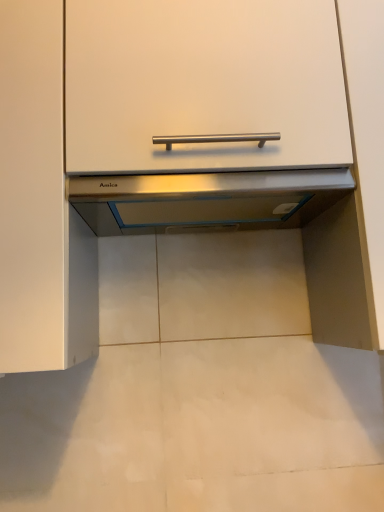
Question: Visually, is satin silver cabinet at center positioned to the left or to the right of satin silver exhaust hood at center?

Choices:
 (A) right
 (B) left

Answer: (B)

Question: Does point (46, 173) appear closer or farther from the camera than point (198, 189)?

Choices:
 (A) farther
 (B) closer

Answer: (B)

Question: In terms of size, does satin silver cabinet at center appear bigger or smaller than satin silver exhaust hood at center?

Choices:
 (A) small
 (B) big

Answer: (B)

Question: In the image, is satin silver exhaust hood at center positioned in front of or behind satin silver cabinet at center?

Choices:
 (A) behind
 (B) front

Answer: (A)

Question: Based on their positions, is satin silver exhaust hood at center located to the left or right of satin silver cabinet at center?

Choices:
 (A) left
 (B) right

Answer: (B)

Question: From a real-world perspective, is satin silver exhaust hood at center physically located above or below satin silver cabinet at center?

Choices:
 (A) below
 (B) above

Answer: (A)

Question: Is satin silver exhaust hood at center situated inside satin silver cabinet at center or outside?

Choices:
 (A) outside
 (B) inside

Answer: (B)